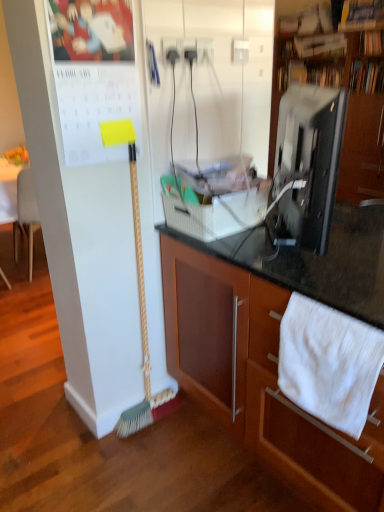
Find the location of `free space above green bristle broom at left (from a real-world perspective)`. free space above green bristle broom at left (from a real-world perspective) is located at coordinates (115, 141).